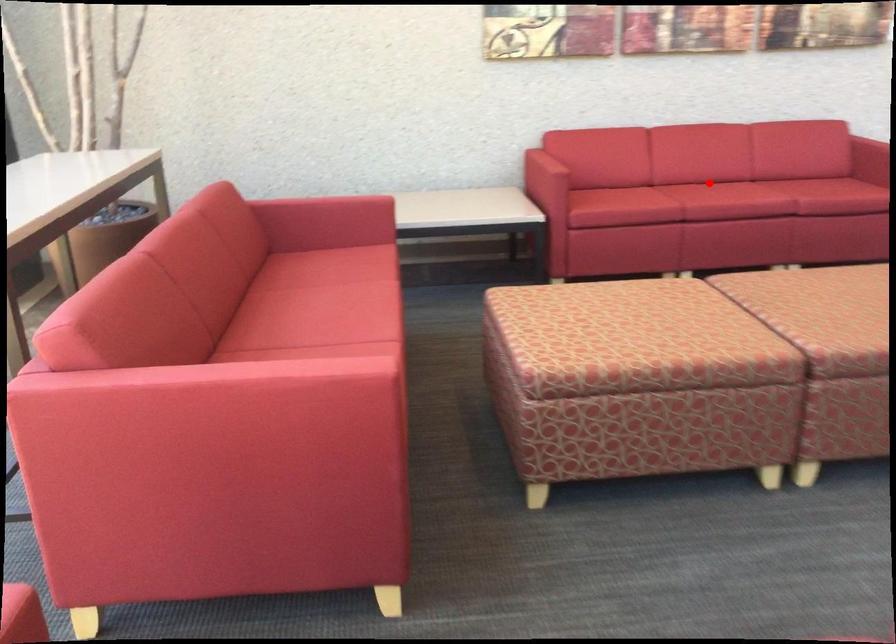
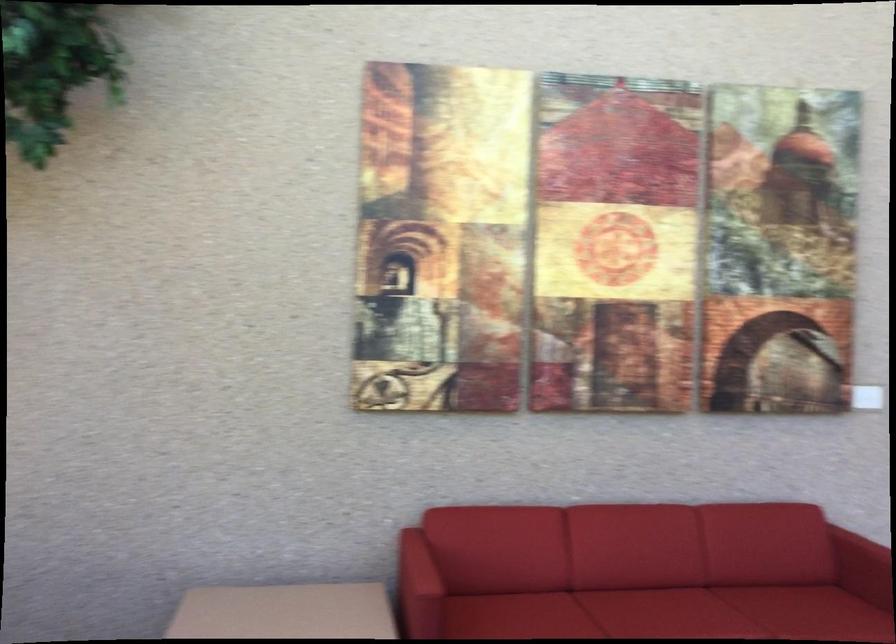
Locate, in the second image, the point that corresponds to the highlighted location in the first image.

(659, 607)